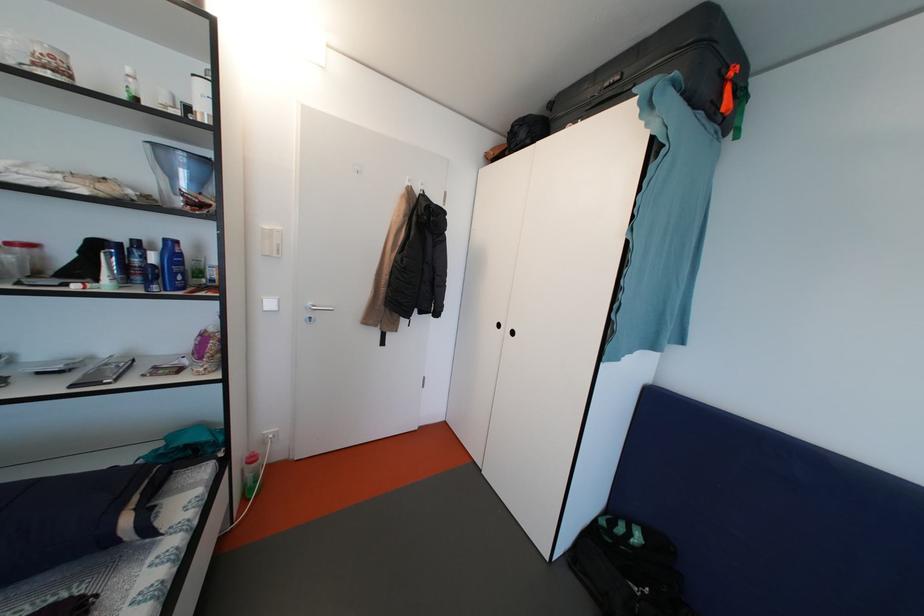
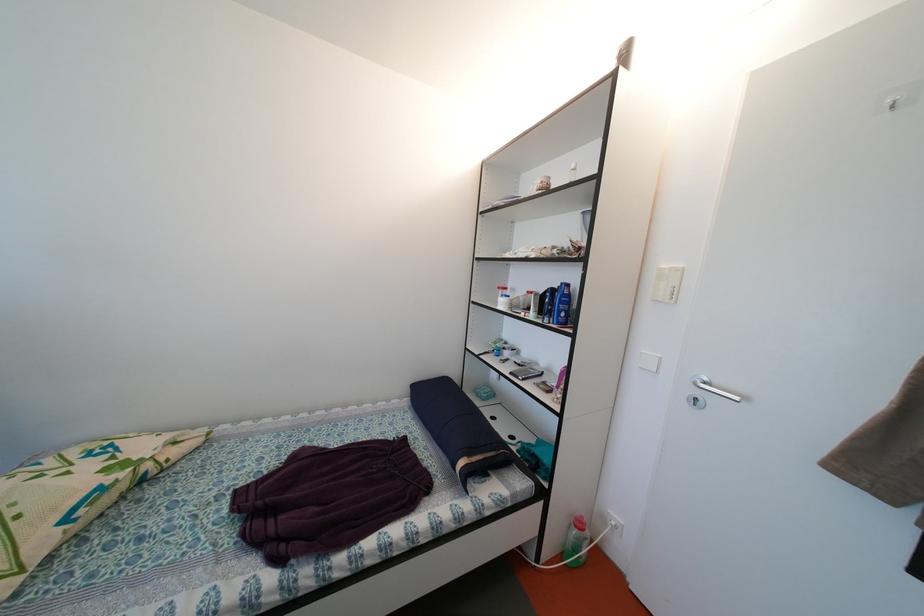
Find the pixel in the second image that matches pixel 173 245 in the first image.

(569, 289)